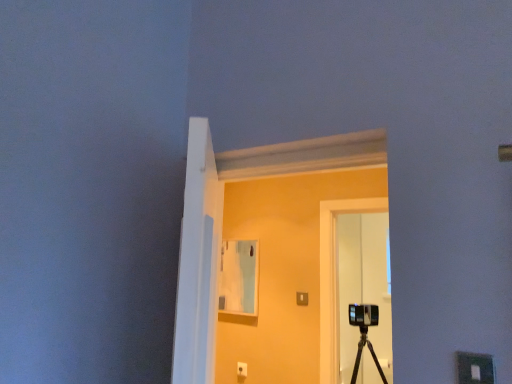
Question: Is transparent glass door at center further to the viewer compared to transparent glass door at center?

Choices:
 (A) yes
 (B) no

Answer: (B)

Question: Is transparent glass door at center closer to camera compared to transparent glass door at center?

Choices:
 (A) yes
 (B) no

Answer: (A)

Question: Is transparent glass door at center in contact with transparent glass door at center?

Choices:
 (A) no
 (B) yes

Answer: (A)

Question: From the image's perspective, is transparent glass door at center over transparent glass door at center?

Choices:
 (A) no
 (B) yes

Answer: (B)

Question: Can you confirm if transparent glass door at center is thinner than transparent glass door at center?

Choices:
 (A) yes
 (B) no

Answer: (B)

Question: From a real-world perspective, is transparent glass door at center positioned under transparent glass door at center based on gravity?

Choices:
 (A) yes
 (B) no

Answer: (B)

Question: Can you confirm if transparent glass door at center is wider than transparent glass door at center?

Choices:
 (A) no
 (B) yes

Answer: (A)

Question: Is transparent glass door at center aimed at transparent glass door at center?

Choices:
 (A) yes
 (B) no

Answer: (A)

Question: From a real-world perspective, does transparent glass door at center stand above transparent glass door at center?

Choices:
 (A) yes
 (B) no

Answer: (B)

Question: Does transparent glass door at center lie in front of transparent glass door at center?

Choices:
 (A) no
 (B) yes

Answer: (A)

Question: Considering the relative sizes of transparent glass door at center and transparent glass door at center in the image provided, is transparent glass door at center thinner than transparent glass door at center?

Choices:
 (A) no
 (B) yes

Answer: (B)

Question: From the image's perspective, would you say transparent glass door at center is shown under transparent glass door at center?

Choices:
 (A) no
 (B) yes

Answer: (B)

Question: From a real-world perspective, relative to transparent glass door at center, is transparent glass door at center vertically above or below?

Choices:
 (A) below
 (B) above

Answer: (A)